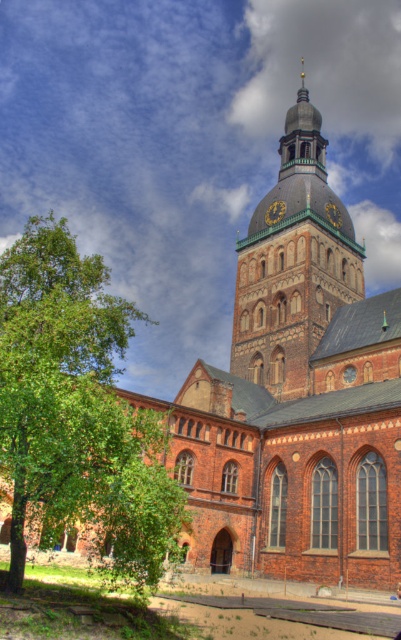
Question: Is green leafy tree at lower left above brown brick tower at center?

Choices:
 (A) yes
 (B) no

Answer: (B)

Question: Considering the real-world distances, which object is farthest from the gold metallic clock at upper center?

Choices:
 (A) brown brick tower at center
 (B) gold textured clock at center

Answer: (A)

Question: Does brown brick tower at center appear on the left side of gold metallic clock at upper center?

Choices:
 (A) yes
 (B) no

Answer: (B)

Question: Which point appears closest to the camera in this image?

Choices:
 (A) (253, 358)
 (B) (0, 444)
 (C) (330, 216)
 (D) (271, 220)

Answer: (B)

Question: Considering the real-world distances, which object is closest to the gold metallic clock at upper center?

Choices:
 (A) green leafy tree at lower left
 (B) gold textured clock at center
 (C) brown brick tower at center

Answer: (B)

Question: Does green leafy tree at lower left appear on the right side of gold textured clock at center?

Choices:
 (A) no
 (B) yes

Answer: (A)